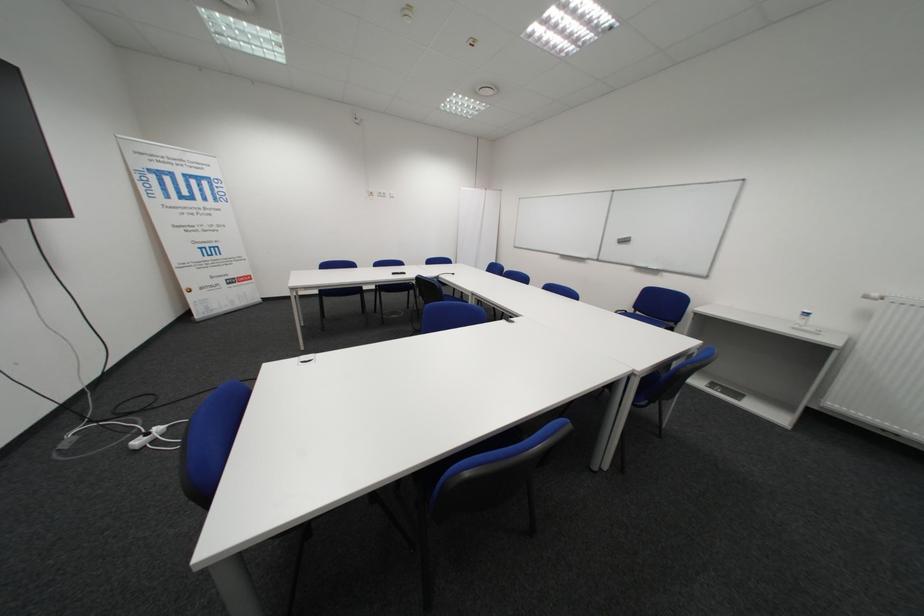
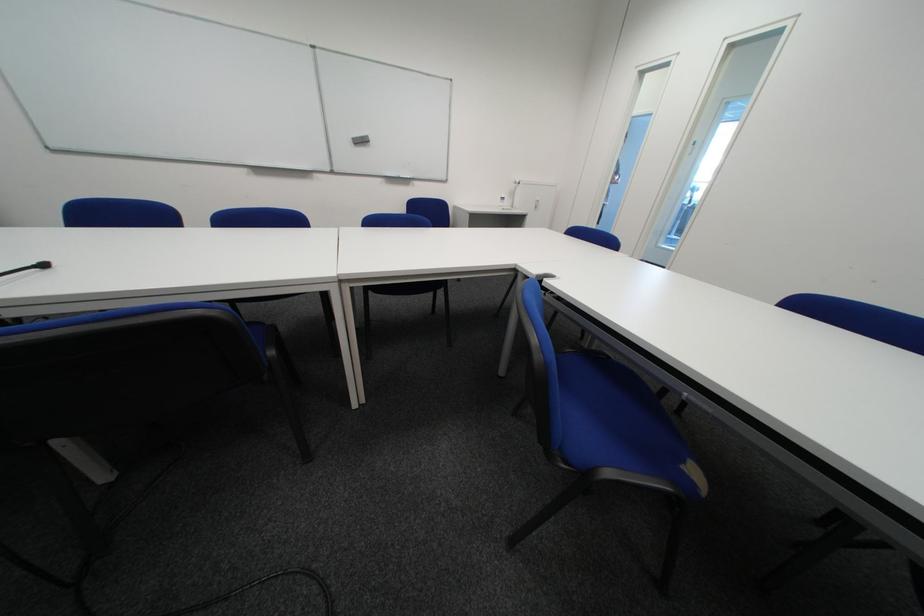
Find the pixel in the second image that matches point 629,241 in the first image.

(365, 140)